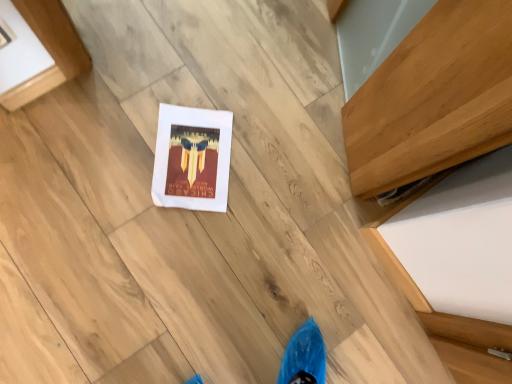
Locate an element on the screen. vacant location behind white paper at center is located at coordinates (240, 100).